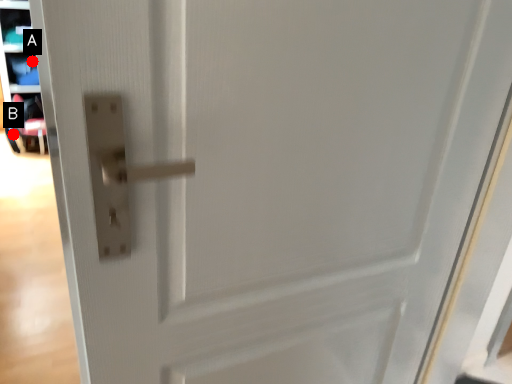
Question: Two points are circled on the image, labeled by A and B beside each circle. Which point is closer to the camera?

Choices:
 (A) A is closer
 (B) B is closer

Answer: (B)